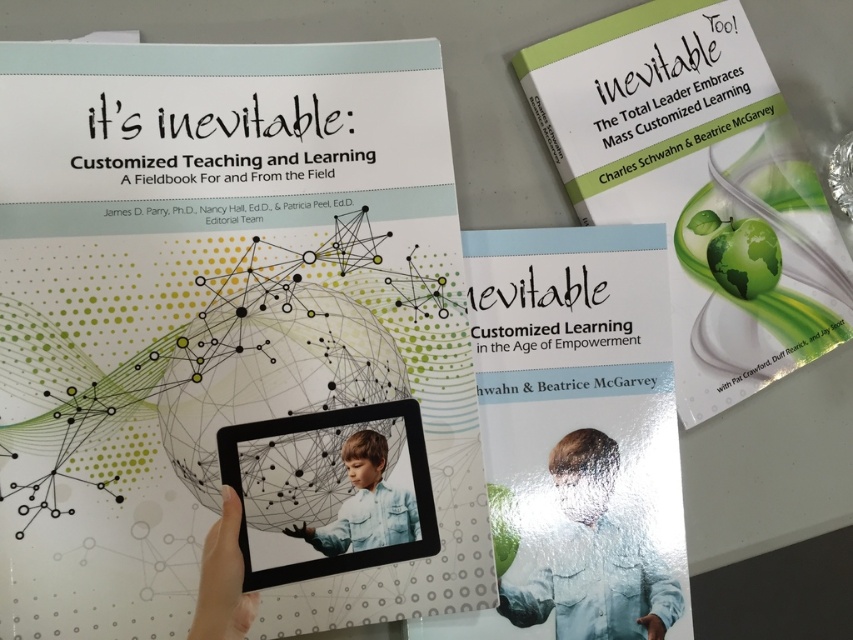
You are a student who wants to pick up the light blue denim shirt at center from the table where the matte green book at center is placed. Can you reach it without moving the book?

The matte green book at center is positioned over light blue denim shirt at center, so you cannot reach the light blue denim shirt at center without moving the book.

You are trying to place the light blue denim shirt at center on top of the matte green book at center. Based on their sizes, will the shirt fit entirely on the book without hanging over the edges?

The matte green book at center is wider than the light blue denim shirt at center, so the shirt should fit entirely on the book without any part hanging over the edges.